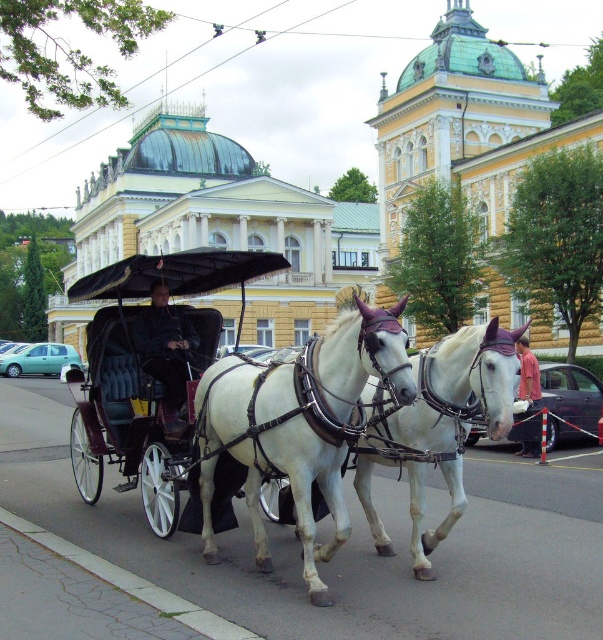
Does black leather carriage at center have a lesser width compared to black leather coach at center?

In fact, black leather carriage at center might be wider than black leather coach at center.

Does black leather carriage at center have a lesser height compared to black leather coach at center?

In fact, black leather carriage at center may be taller than black leather coach at center.

Identify the location of black leather carriage at center. (154, 349).

In order to click on black leather carriage at center in this screenshot , I will do `click(154, 349)`.

Can you confirm if white leather horse at center is bigger than red cotton shirt at lower right?

Actually, white leather horse at center might be smaller than red cotton shirt at lower right.

Who is more distant from viewer, (390, 307) or (534, 456)?

Point (390, 307)

Who is more distant from viewer, (x=343, y=340) or (x=537, y=406)?

The point (x=537, y=406) is more distant.

The height and width of the screenshot is (640, 603). Identify the location of white leather horse at center. (298, 424).

Between white leather horse at center and black leather coach at center, which one has less height?

black leather coach at center

Can you confirm if white leather horse at center is bigger than black leather coach at center?

Indeed, white leather horse at center has a larger size compared to black leather coach at center.

Which is behind, point (379, 372) or point (148, 336)?

The point (148, 336) is behind.

At what (x,y) coordinates should I click in order to perform the action: click on white leather horse at center. Please return your answer as a coordinate pair (x, y). This screenshot has width=603, height=640. Looking at the image, I should click on (298, 424).